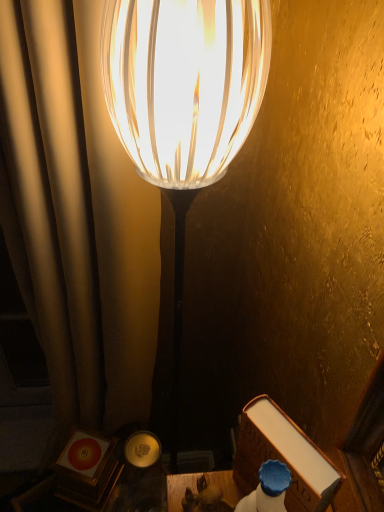
What do you see at coordinates (183, 102) in the screenshot? I see `translucent glass lamp at center` at bounding box center [183, 102].

You are a GUI agent. You are given a task and a screenshot of the screen. Output one action in this format:
    pyautogui.click(x=<x>, y=<y>)
    Task: Click on the translucent glass lamp at center
    
    Given the screenshot: What is the action you would take?
    pyautogui.click(x=183, y=102)

What is the approximate height of brown leather book at lower right?

The height of brown leather book at lower right is 6.90 inches.

Where is `translucent glass lamp at center`? This screenshot has height=512, width=384. translucent glass lamp at center is located at coordinates (183, 102).

Relative to wooden table at lower center, is brown leather book at lower right in front or behind?

Result: In the image, brown leather book at lower right appears in front of wooden table at lower center.

From the image's perspective, is brown leather book at lower right below wooden table at lower center?

No, from the image's perspective, brown leather book at lower right is not beneath wooden table at lower center.

Which is more to the right, brown leather book at lower right or wooden table at lower center?

brown leather book at lower right.

Considering the sizes of objects brown leather book at lower right and wooden table at lower center in the image provided, who is shorter, brown leather book at lower right or wooden table at lower center?

wooden table at lower center.

Does brown leather book at lower right have a greater width compared to translucent glass lamp at center?

In fact, brown leather book at lower right might be narrower than translucent glass lamp at center.

Considering their positions, is brown leather book at lower right located in front of or behind translucent glass lamp at center?

brown leather book at lower right is positioned farther from the viewer than translucent glass lamp at center.

From a real-world perspective, is brown leather book at lower right above or below translucent glass lamp at center?

Clearly, from a real-world perspective, brown leather book at lower right is above translucent glass lamp at center.

How different are the orientations of brown leather book at lower right and translucent glass lamp at center in degrees?

They differ by 2.87 degrees in their facing directions.

Consider the image. Is translucent glass lamp at center touching brown leather book at lower right?

translucent glass lamp at center and brown leather book at lower right are clearly separated.

Is point (233, 55) closer or farther from the camera than point (298, 486)?

Point (233, 55) is positioned farther from the camera compared to point (298, 486).

From the image's perspective, is translucent glass lamp at center located beneath brown leather book at lower right?

Actually, translucent glass lamp at center appears above brown leather book at lower right in the image.

Looking at this image, can we say wooden table at lower center lies outside translucent glass lamp at center?

Absolutely, wooden table at lower center is external to translucent glass lamp at center.

How far apart are wooden table at lower center and translucent glass lamp at center?

The distance of wooden table at lower center from translucent glass lamp at center is 21.43 inches.

Is point (195, 481) positioned before point (208, 28)?

No, (195, 481) is behind (208, 28).

Does wooden table at lower center have a smaller size compared to translucent glass lamp at center?

Correct, wooden table at lower center occupies less space than translucent glass lamp at center.

Is wooden table at lower center completely or partially inside translucent glass lamp at center?

That's incorrect, wooden table at lower center is not inside translucent glass lamp at center.

From a real-world perspective, between translucent glass lamp at center and wooden table at lower center, who is vertically lower?

From a 3D spatial view, translucent glass lamp at center is below.

Considering the points (120, 33) and (219, 476), which point is in front, point (120, 33) or point (219, 476)?

The point (120, 33) is more forward.

Would you consider wooden table at lower center to be distant from brown leather book at lower right?

No, wooden table at lower center is in close proximity to brown leather book at lower right.

From the image's perspective, is wooden table at lower center on top of brown leather book at lower right?

No, from the image's perspective, wooden table at lower center is not on top of brown leather book at lower right.

Is wooden table at lower center situated inside brown leather book at lower right or outside?

wooden table at lower center is spatially situated outside brown leather book at lower right.

Which object is thinner, wooden table at lower center or brown leather book at lower right?

With smaller width is brown leather book at lower right.

Identify the location of table located behind the brown leather book at lower right. (179, 489).

The height and width of the screenshot is (512, 384). Identify the location of book above the translucent glass lamp at center (from a real-world perspective). (283, 457).

Based on their spatial positions, is wooden table at lower center or brown leather book at lower right closer to translucent glass lamp at center?

Among the two, brown leather book at lower right is located nearer to translucent glass lamp at center.

From the image, which object appears to be farther from translucent glass lamp at center, brown leather book at lower right or wooden table at lower center?

wooden table at lower center lies further to translucent glass lamp at center than the other object.

Considering their positions, is wooden table at lower center positioned closer to brown leather book at lower right than translucent glass lamp at center?

wooden table at lower center lies closer to brown leather book at lower right than the other object.

Looking at this image, based on their spatial positions, is translucent glass lamp at center or brown leather book at lower right closer to wooden table at lower center?

brown leather book at lower right is positioned closer to the anchor wooden table at lower center.

When comparing their distances from brown leather book at lower right, does translucent glass lamp at center or wooden table at lower center seem further?

translucent glass lamp at center.

Which object lies nearer to the anchor point wooden table at lower center, brown leather book at lower right or translucent glass lamp at center?

brown leather book at lower right lies closer to wooden table at lower center than the other object.

Find the location of `book between translucent glass lamp at center and wooden table at lower center in the front-back direction`. book between translucent glass lamp at center and wooden table at lower center in the front-back direction is located at coordinates (283, 457).